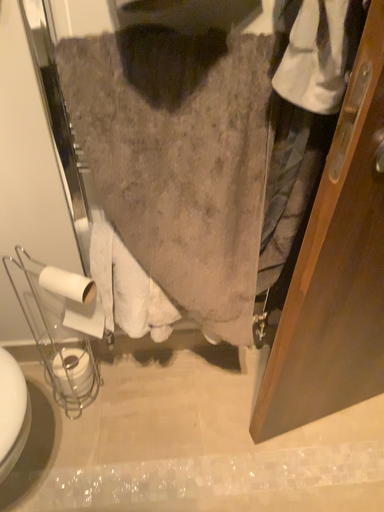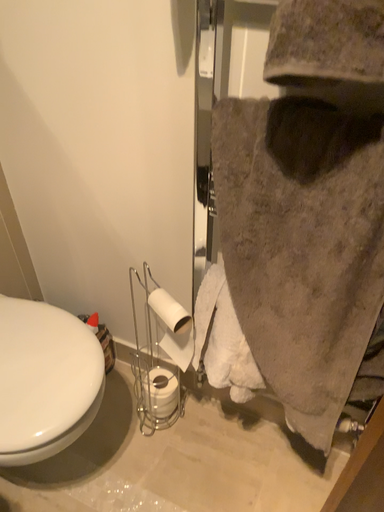
Question: How did the camera likely rotate when shooting the video?

Choices:
 (A) rotated left
 (B) rotated right

Answer: (A)